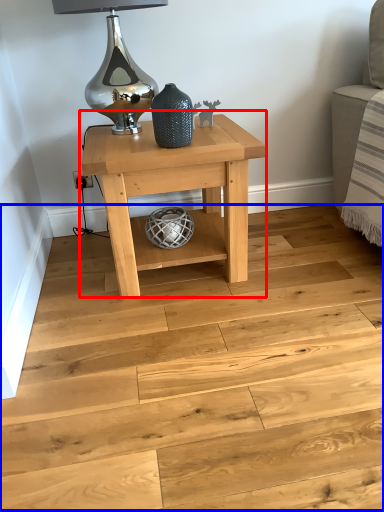
Question: Which object appears closest to the camera in this image, table (highlighted by a red box) or stair (highlighted by a blue box)?

Choices:
 (A) table
 (B) stair

Answer: (B)